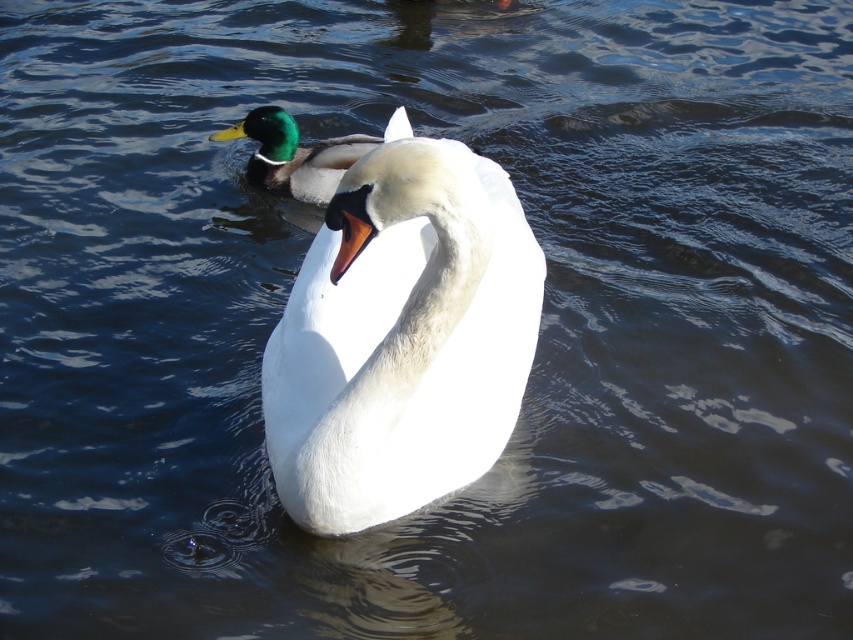
Can you confirm if white glossy swan at center is positioned to the left of green glossy duck at upper left?

Incorrect, white glossy swan at center is not on the left side of green glossy duck at upper left.

Looking at this image, can you confirm if white glossy swan at center is positioned to the right of green glossy duck at upper left?

Indeed, white glossy swan at center is positioned on the right side of green glossy duck at upper left.

Between point (397, 483) and point (360, 134), which one is positioned behind?

Point (360, 134)

At what (x,y) coordinates should I click in order to perform the action: click on white glossy swan at center. Please return your answer as a coordinate pair (x, y). This screenshot has height=640, width=853. Looking at the image, I should click on (401, 337).